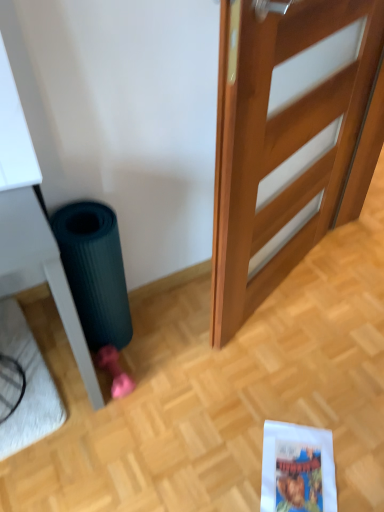
Where is `free space that is to the left of blue glossy comic book at lower right`? free space that is to the left of blue glossy comic book at lower right is located at coordinates point(224,460).